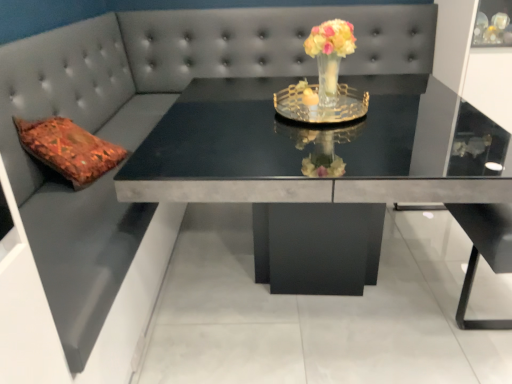
Question: Looking at their shapes, would you say translucent glass vase at center is wider or thinner than matte gray table at center?

Choices:
 (A) wide
 (B) thin

Answer: (B)

Question: Is translucent glass vase at center to the left or to the right of matte gray table at center in the image?

Choices:
 (A) right
 (B) left

Answer: (A)

Question: Considering the positions of translucent glass vase at center and matte gray table at center in the image, is translucent glass vase at center bigger or smaller than matte gray table at center?

Choices:
 (A) small
 (B) big

Answer: (A)

Question: Does point (245, 198) appear closer or farther from the camera than point (343, 24)?

Choices:
 (A) closer
 (B) farther

Answer: (A)

Question: From the image's perspective, is matte gray table at center positioned above or below translucent glass vase at center?

Choices:
 (A) above
 (B) below

Answer: (B)

Question: Considering their positions, is matte gray table at center located in front of or behind translucent glass vase at center?

Choices:
 (A) front
 (B) behind

Answer: (A)

Question: In terms of width, does matte gray table at center look wider or thinner when compared to translucent glass vase at center?

Choices:
 (A) thin
 (B) wide

Answer: (B)